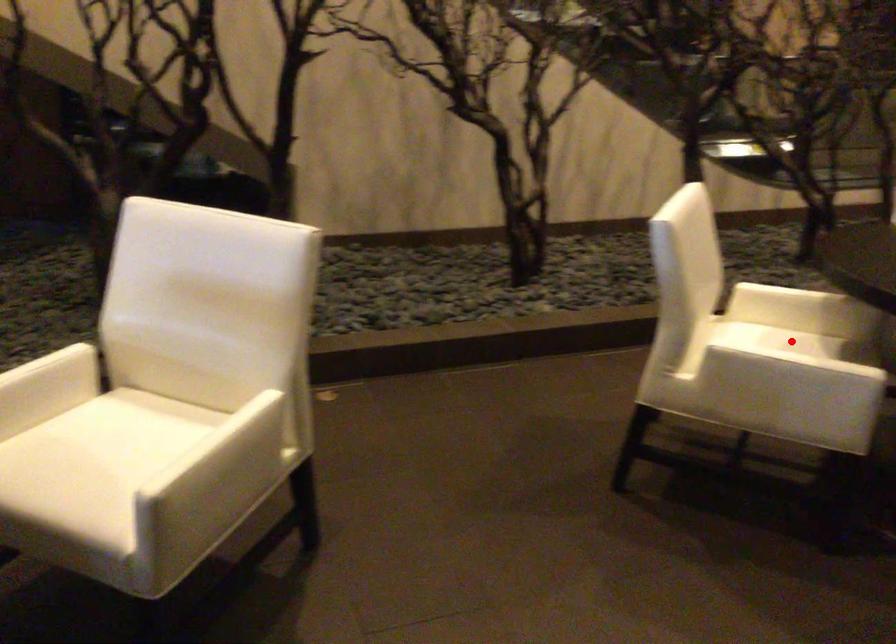
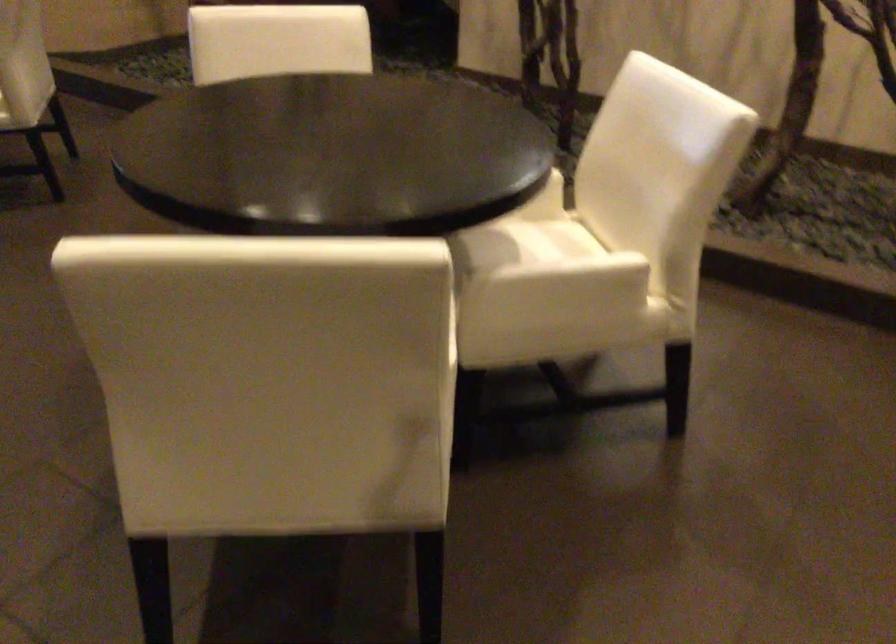
Question: I am providing you with two images of the same scene from different viewpoints. A red point is marked on the first image. At the location where the point appears in image 1, is it still visible in image 2?

Choices:
 (A) Yes
 (B) No

Answer: (B)